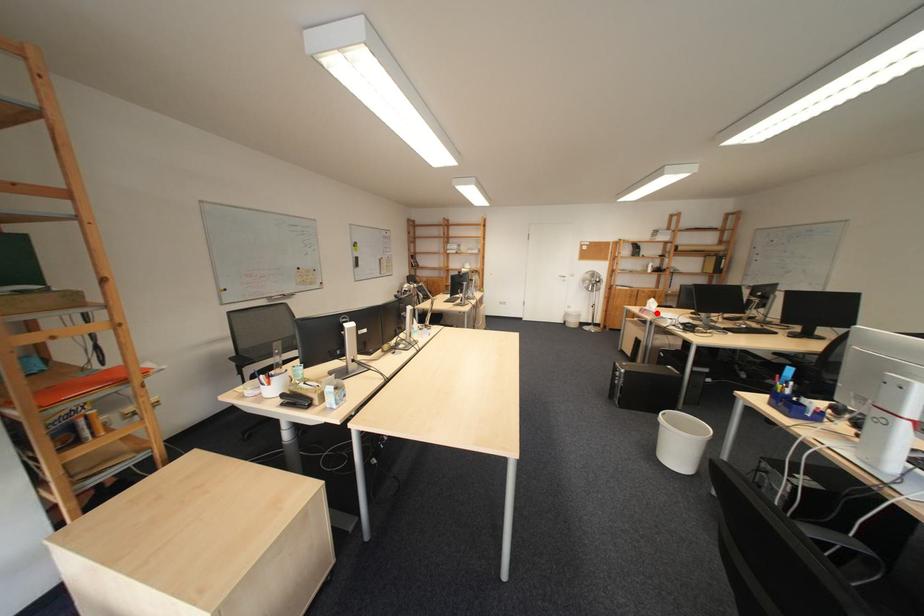
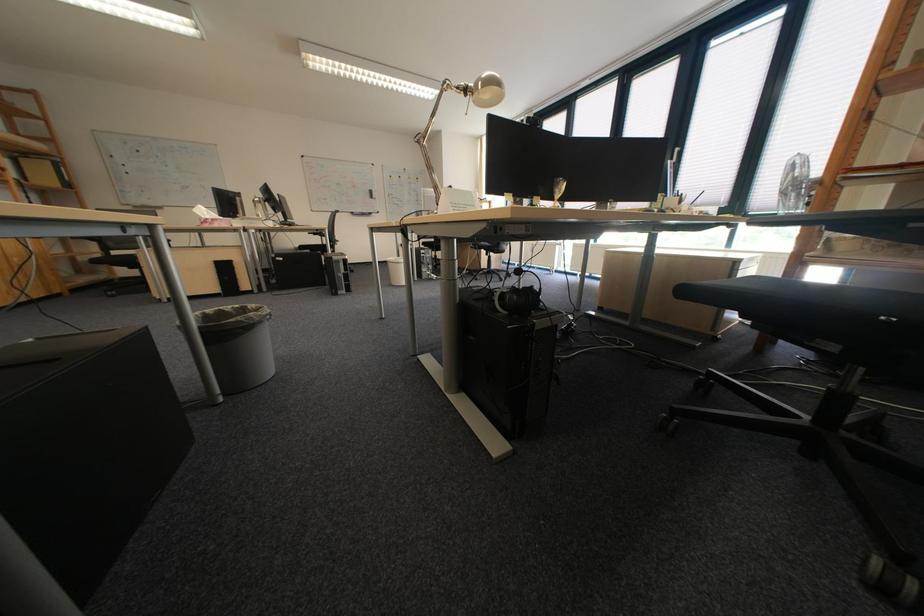
In the second image, find the point that corresponds to the highlighted location in the first image.

(225, 225)